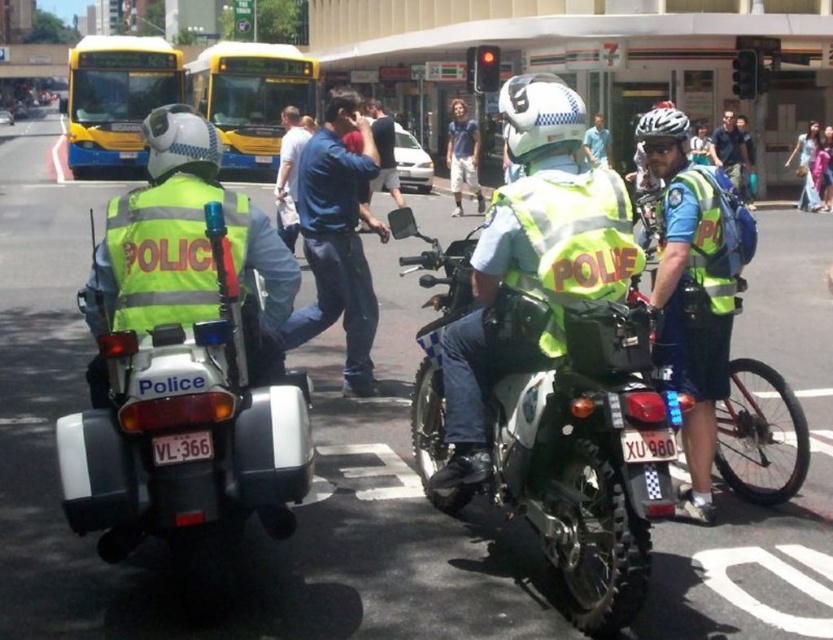
From the picture: You are a pedestrian standing at the point labeled as point (x=188, y=435) in the scene. Which object are you standing on?

You are standing on the white matte police motorcycle at left.

You are a pedestrian standing on the sidewalk and see the white matte police motorcycle at left and the blue denim jeans at center. Which object is closer to the ground?

The white matte police motorcycle at left is located below blue denim jeans at center, so it is closer to the ground.

You are a city planner analyzing traffic flow. You observe the yellow metallic bus at upper left and the yellowmetallicbus at upper center in the scene. Which bus has a higher position in the image?

The yellow metallic bus at upper left has a greater height compared to yellowmetallicbus at upper center, so it is positioned higher in the image.